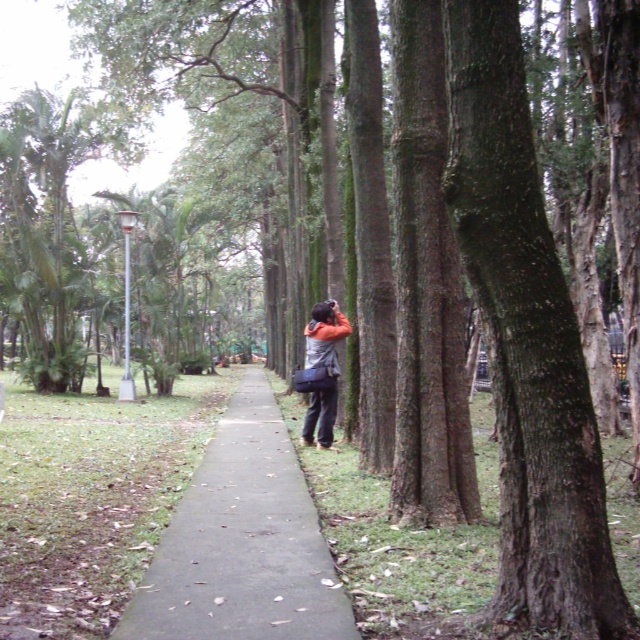
Between gray concrete sidewalk at center and orange fabric jacket at center, which one appears on the left side from the viewer's perspective?

gray concrete sidewalk at center is more to the left.

Who is more forward, (x=172, y=548) or (x=342, y=332)?

Point (x=172, y=548) is more forward.

Consider the image. Who is more forward, (211, 596) or (336, 307)?

Point (211, 596) is more forward.

The image size is (640, 640). Identify the location of gray concrete sidewalk at center. (243, 541).